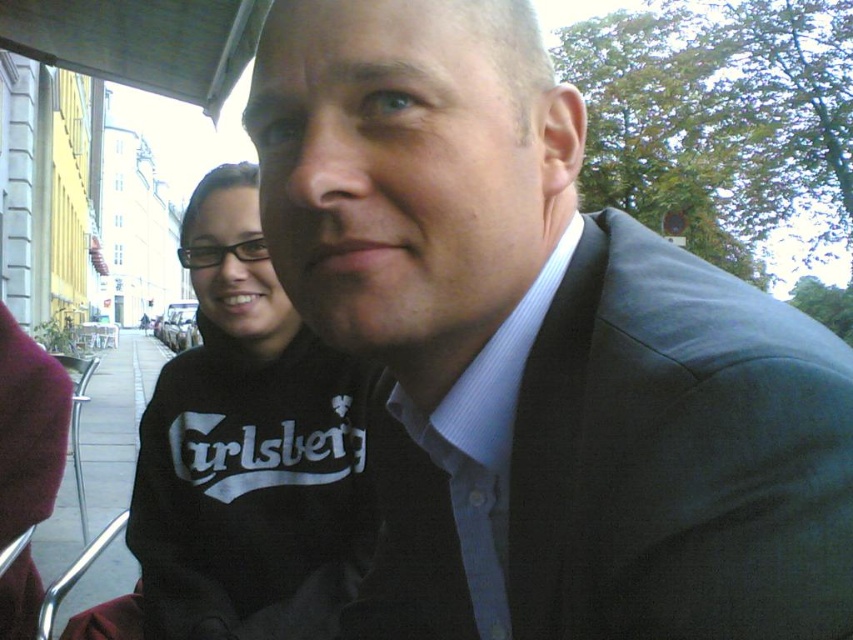
Please look at the image and focus on the point at coordinates (538, 352). What object is located exactly at this point?

The object at point (538, 352) is the matte black suit at center.

You are a fashion designer observing two people in an urban setting. You notice the matte black suit at center and the black cotton sweatshirt at center. Which clothing item is shorter in height?

The matte black suit at center is not as tall as the black cotton sweatshirt at center, so the matte black suit at center is shorter in height.